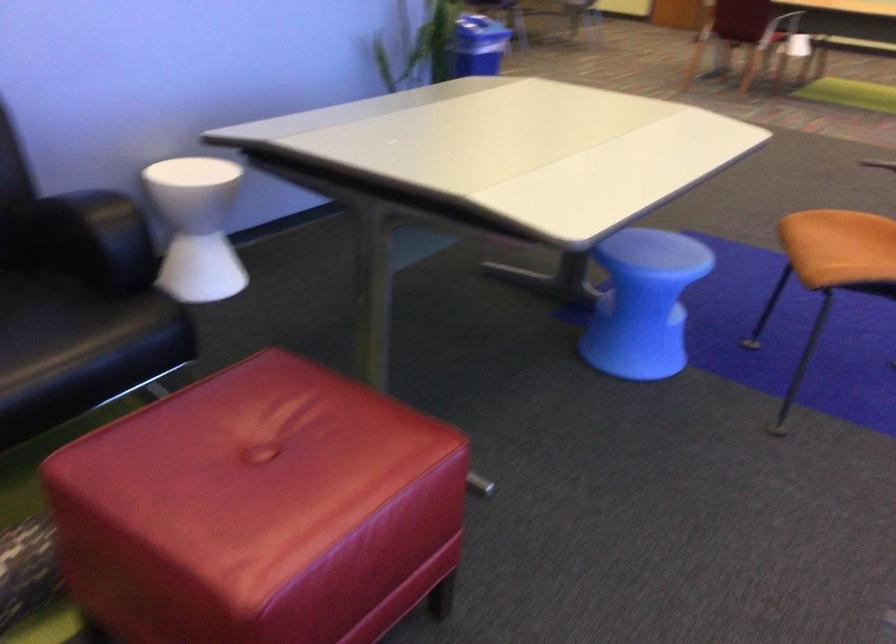
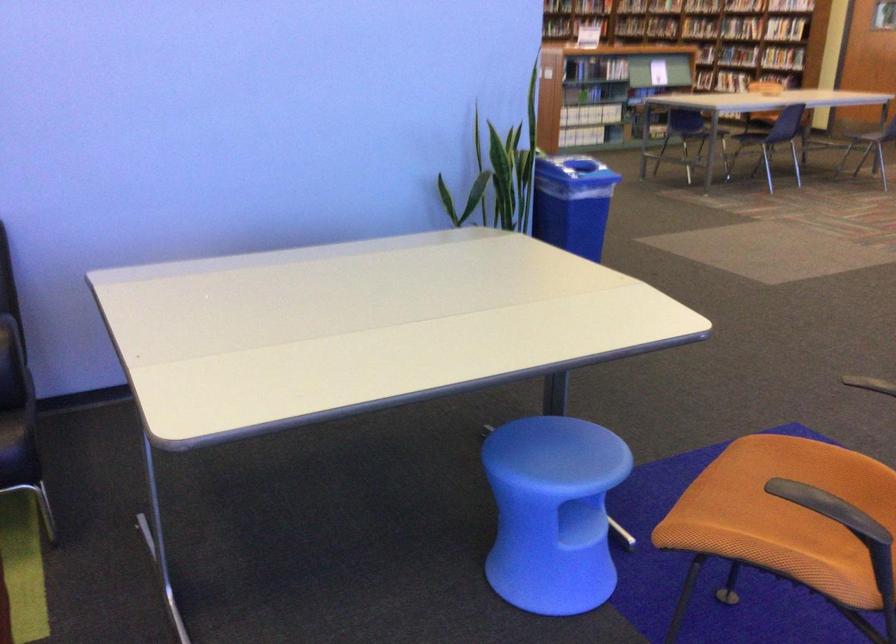
Where in the second image is the point corresponding to [678,294] from the first image?

(553, 512)